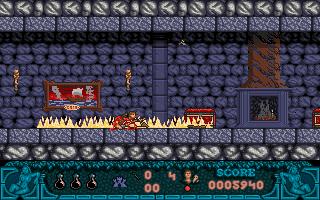
The width and height of the screenshot is (320, 200). Identify the location of chimney. (261, 64).